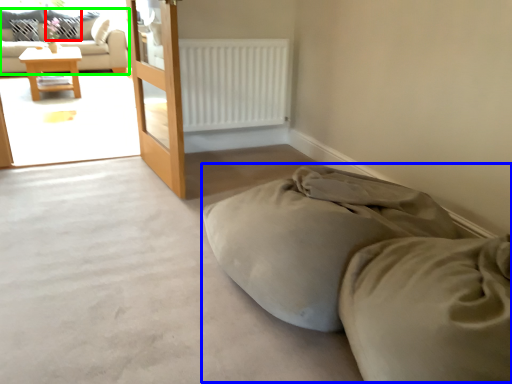
Question: Considering the real-world distances, which object is farthest from pillow (highlighted by a red box)? bed (highlighted by a blue box) or studio couch (highlighted by a green box)?

Choices:
 (A) bed
 (B) studio couch

Answer: (A)